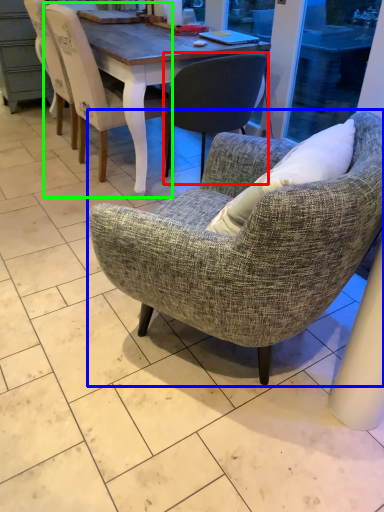
Question: Based on their relative distances, which object is farther from chair (highlighted by a red box)? Choose from chair (highlighted by a blue box) and chair (highlighted by a green box).

Choices:
 (A) chair
 (B) chair

Answer: (A)